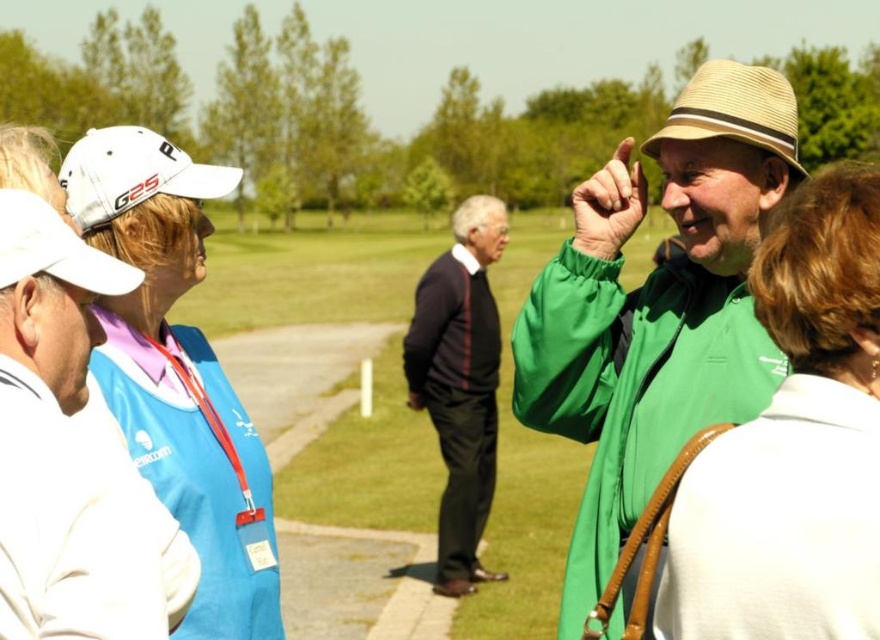
Question: Does green matte jacket at center appear under white fabric cap at upper left?

Choices:
 (A) no
 (B) yes

Answer: (A)

Question: From the image, what is the correct spatial relationship of green matte jacket at center in relation to white fabric cap at upper left?

Choices:
 (A) right
 (B) left

Answer: (A)

Question: From the image, what is the correct spatial relationship of green matte jacket at center in relation to white matte baseball cap at upper left?

Choices:
 (A) right
 (B) left

Answer: (A)

Question: Among these objects, which one is nearest to the camera?

Choices:
 (A) dark blue sweater at center
 (B) straw hat at upper center

Answer: (B)

Question: Based on their relative distances, which object is farther from the straw hat at upper right?

Choices:
 (A) white fabric cap at upper left
 (B) white straw hat at upper left
 (C) white matte baseball cap at upper left

Answer: (A)

Question: Which object is the farthest from the white straw hat at upper left?

Choices:
 (A) green matte jacket at center
 (B) straw hat at upper right

Answer: (B)